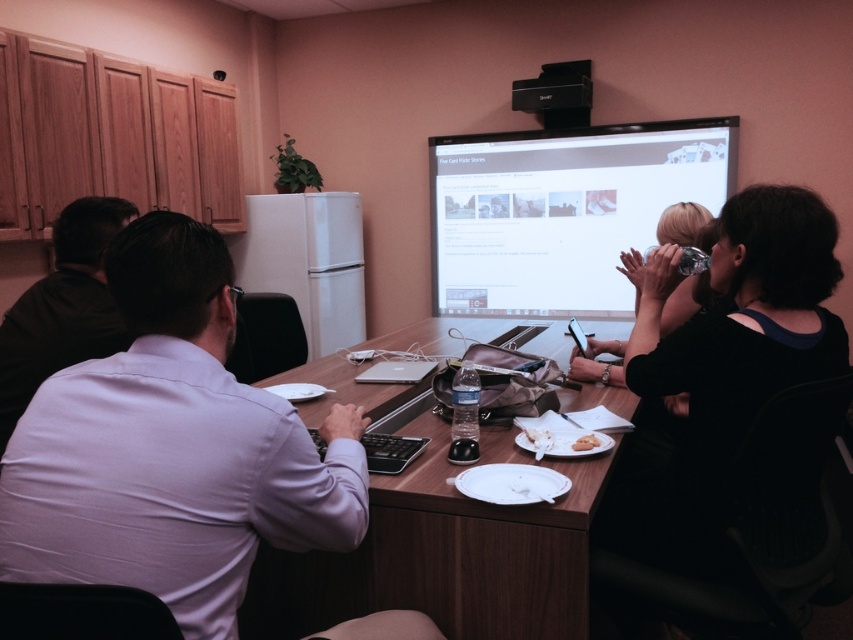
You are sitting in the meeting room and need to pass a document to the person wearing the dark gray shirt at left. Since the brown wood table at center is in the way, can you still reach them without moving the table?

The brown wood table at center is in front of the dark gray shirt at left, so you can still reach them by passing the document around the sides or ends of the table.

You are a person standing in the meeting room. You need to place a 15 cm tall paperweight on the brown wood table at center. Will the paperweight be taller than the matte white screen at upper center?

The brown wood table at center has a lesser height compared to matte white screen at upper center. The paperweight is 15 cm tall, but without knowing the exact height of the table or screen, we can only confirm the table is shorter. The screen is taller than the table, so the paperweight on the table cannot be taller than the screen.